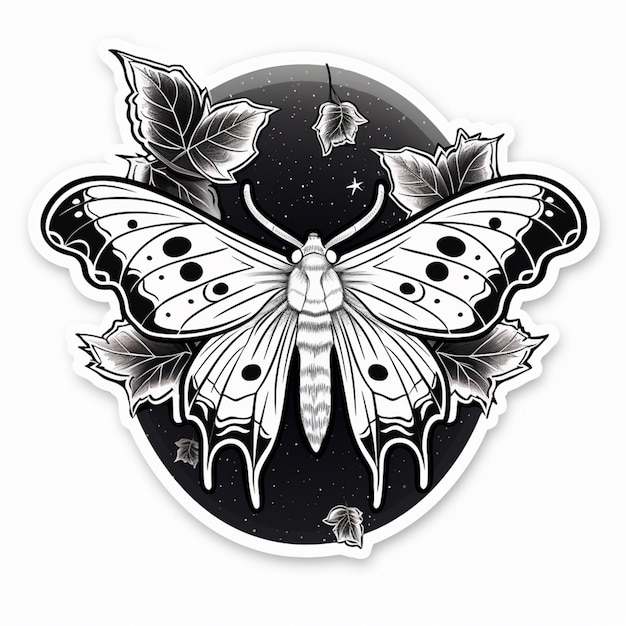
Find the location of a particular element. This screenshot has height=626, width=626. sticker is located at coordinates (310, 536).